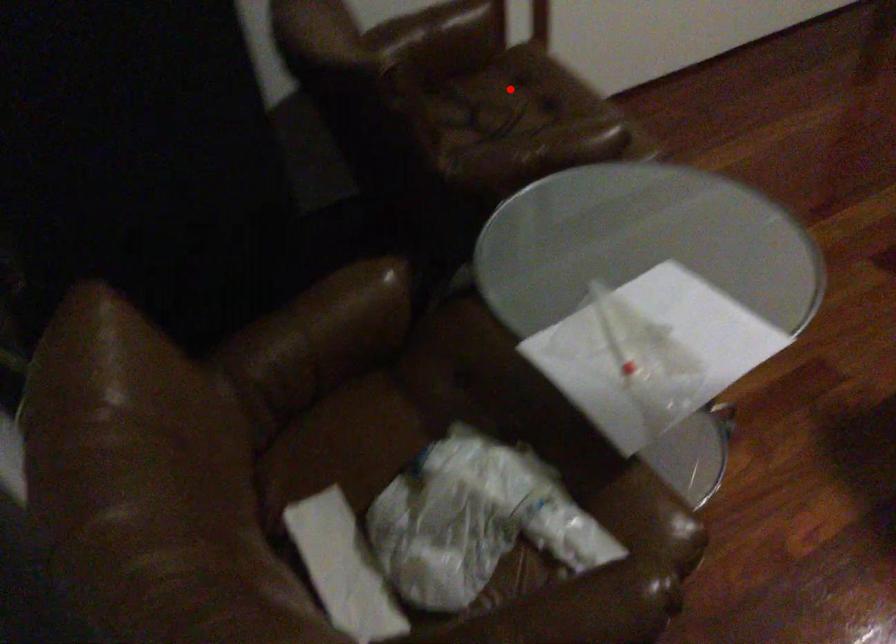
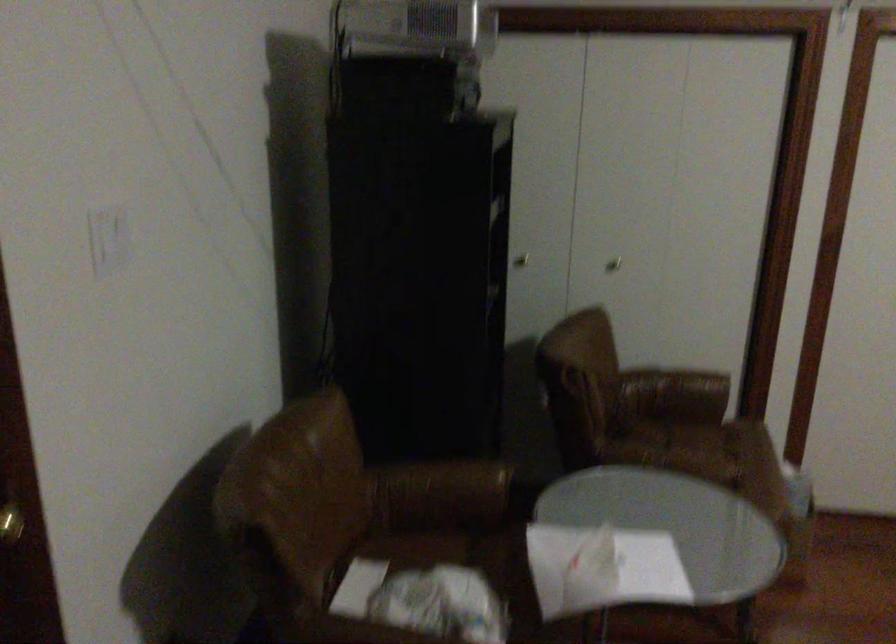
In the second image, find the point that corresponds to the highlighted location in the first image.

(718, 442)